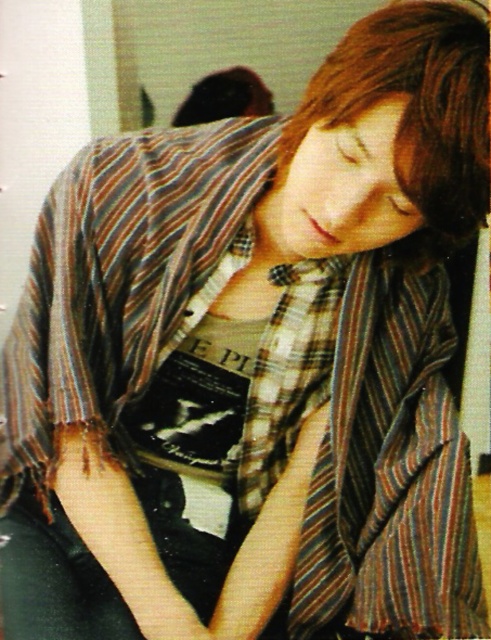
You are an artist trying to sketch the person in the image. You notice two distinct hair sections on their head. Which of the two hair sections, the brown smooth hair at upper center or the shiny brown hair at upper center, would you depict as having a smaller width?

The brown smooth hair at upper center is thinner than the shiny brown hair at upper center, so you should depict the brown smooth hair at upper center as having a smaller width.